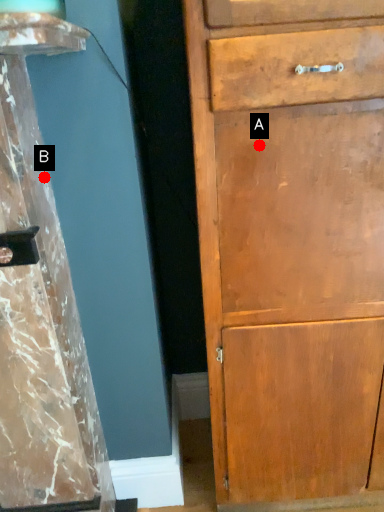
Question: Two points are circled on the image, labeled by A and B beside each circle. Which of the following is the farthest from the observer?

Choices:
 (A) A is further
 (B) B is further

Answer: (B)